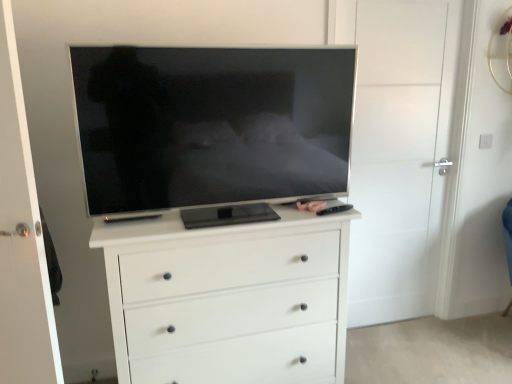
Question: Visually, is matte black tv at center positioned to the left or to the right of matte black remote control at center?

Choices:
 (A) left
 (B) right

Answer: (A)

Question: Looking at their shapes, would you say matte black tv at center is wider or thinner than matte black remote control at center?

Choices:
 (A) wide
 (B) thin

Answer: (A)

Question: Considering the real-world distances, which object is farthest from the matte black remote control at center?

Choices:
 (A) white matte chest of drawers at center
 (B) white matte door at center, placed as the 2th door when sorted from back to front
 (C) white matte door at center, the second door viewed from the front
 (D) matte black tv at center
 (E) black plastic remote at right

Answer: (B)

Question: Based on their relative distances, which object is farther from the white matte door at center, the 1th door when ordered from right to left?

Choices:
 (A) white matte door at center, the 1th door from the front
 (B) black plastic remote at right
 (C) matte black remote control at center
 (D) white matte chest of drawers at center
 (E) matte black tv at center

Answer: (A)